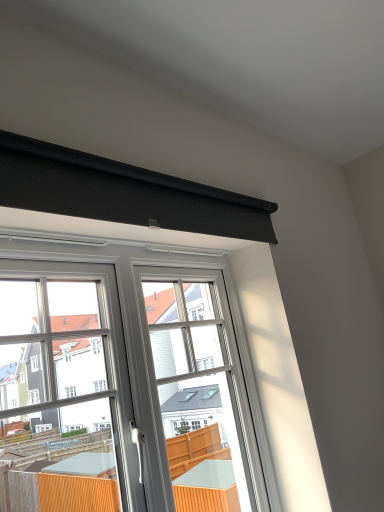
What are the coordinates of `matte gray window at center` in the screenshot? It's located at (134, 381).

Describe the element at coordinates (134, 381) in the screenshot. I see `matte gray window at center` at that location.

What is the approximate height of matte gray window at center?

matte gray window at center is 39.24 inches tall.

Where is `matte gray window at center`? The height and width of the screenshot is (512, 384). matte gray window at center is located at coordinates (134, 381).